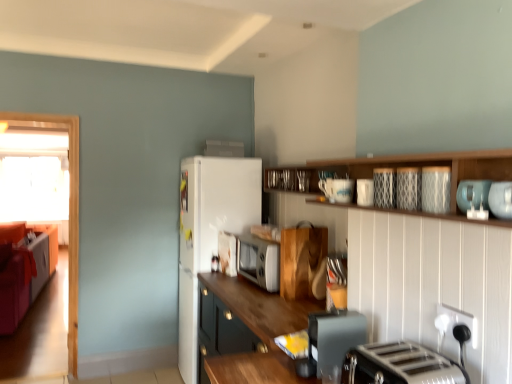
This screenshot has width=512, height=384. Identify the location of free space in front of wooden microwave at center, the 5th appliance when ordered from front to back. (270, 301).